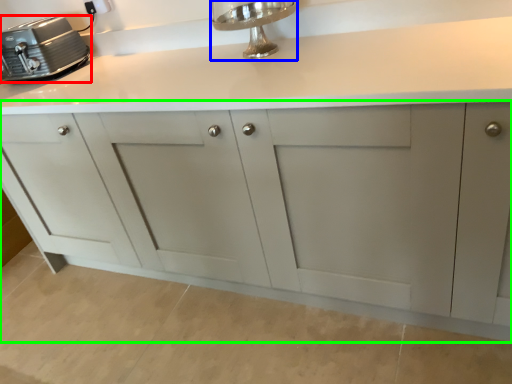
Question: Which object is positioned closest to home appliance (highlighted by a red box)? Select from faucet (highlighted by a blue box) and cabinetry (highlighted by a green box).

Choices:
 (A) faucet
 (B) cabinetry

Answer: (B)